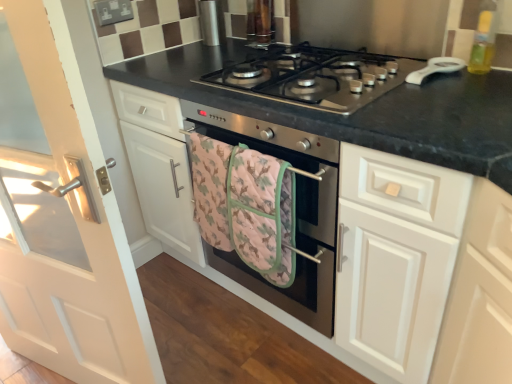
Question: Is stainless steel oven at center smaller than pink quilted towel at center?

Choices:
 (A) yes
 (B) no

Answer: (B)

Question: Is stainless steel oven at center aimed at pink quilted towel at center?

Choices:
 (A) no
 (B) yes

Answer: (B)

Question: Is stainless steel oven at center next to pink quilted towel at center and touching it?

Choices:
 (A) no
 (B) yes

Answer: (B)

Question: Is pink quilted towel at center surrounded by stainless steel oven at center?

Choices:
 (A) no
 (B) yes

Answer: (A)

Question: Is stainless steel oven at center at the right side of pink quilted towel at center?

Choices:
 (A) yes
 (B) no

Answer: (A)

Question: Is stainless steel oven at center positioned with its back to pink quilted towel at center?

Choices:
 (A) yes
 (B) no

Answer: (B)

Question: Considering the relative sizes of white glossy door at left and pink quilted towel at center in the image provided, is white glossy door at left bigger than pink quilted towel at center?

Choices:
 (A) yes
 (B) no

Answer: (A)

Question: Is white glossy door at left facing away from pink quilted towel at center?

Choices:
 (A) no
 (B) yes

Answer: (A)

Question: Considering the relative sizes of white glossy door at left and pink quilted towel at center in the image provided, is white glossy door at left smaller than pink quilted towel at center?

Choices:
 (A) no
 (B) yes

Answer: (A)

Question: From the image's perspective, is white glossy door at left on pink quilted towel at center?

Choices:
 (A) yes
 (B) no

Answer: (B)

Question: Is white glossy door at left in front of pink quilted towel at center?

Choices:
 (A) no
 (B) yes

Answer: (B)

Question: Can you confirm if white glossy door at left is taller than pink quilted towel at center?

Choices:
 (A) yes
 (B) no

Answer: (A)

Question: Does stainless steel oven at center have a smaller size compared to white glossy door at left?

Choices:
 (A) no
 (B) yes

Answer: (A)